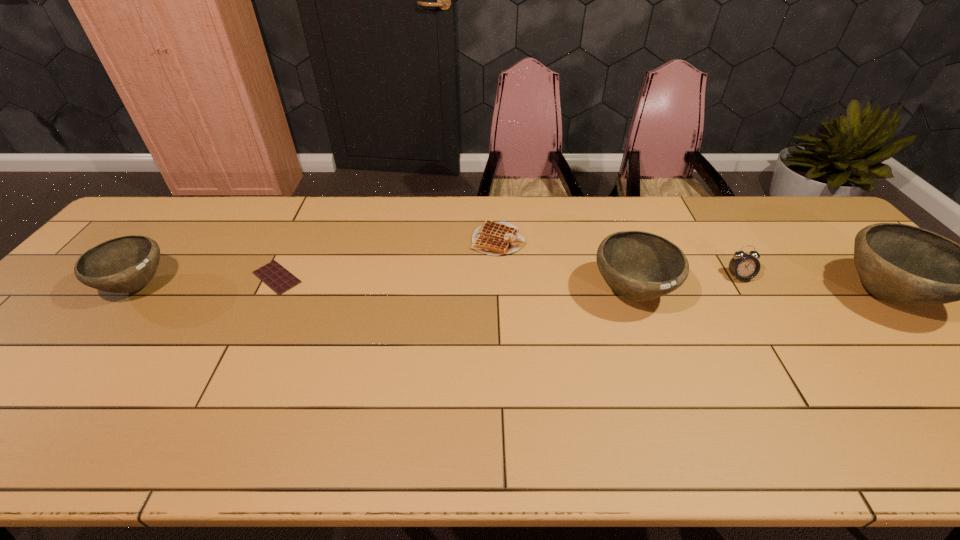
This screenshot has width=960, height=540. I want to click on free space located 0.210m on the right of the shortest bowl, so click(248, 286).

Where is `vacant space located on the right of the fourth object from left to right`? The height and width of the screenshot is (540, 960). vacant space located on the right of the fourth object from left to right is located at coordinates (788, 293).

Where is `vacant space positioned 0.390m on the right of the fifth tallest object`? This screenshot has height=540, width=960. vacant space positioned 0.390m on the right of the fifth tallest object is located at coordinates (651, 240).

This screenshot has width=960, height=540. Find the location of `vacant space located 0.160m on the front of the shortest object`. vacant space located 0.160m on the front of the shortest object is located at coordinates (245, 343).

Locate an element on the screen. The height and width of the screenshot is (540, 960). free space located on the face of the third shortest object is located at coordinates (821, 407).

In order to click on object located at the far edge in this screenshot , I will do `click(492, 238)`.

Locate an element on the screen. This screenshot has height=540, width=960. object present at the left edge is located at coordinates (125, 264).

Locate an element on the screen. Image resolution: width=960 pixels, height=540 pixels. free space at the far edge of the desktop is located at coordinates (745, 202).

In the image, there is a desktop. At what (x,y) coordinates should I click in order to perform the action: click on vacant space at the near edge. Please return your answer as a coordinate pair (x, y). Image resolution: width=960 pixels, height=540 pixels. Looking at the image, I should click on (679, 379).

In the image, there is a desktop. Where is `vacant space at the left edge`? vacant space at the left edge is located at coordinates (102, 309).